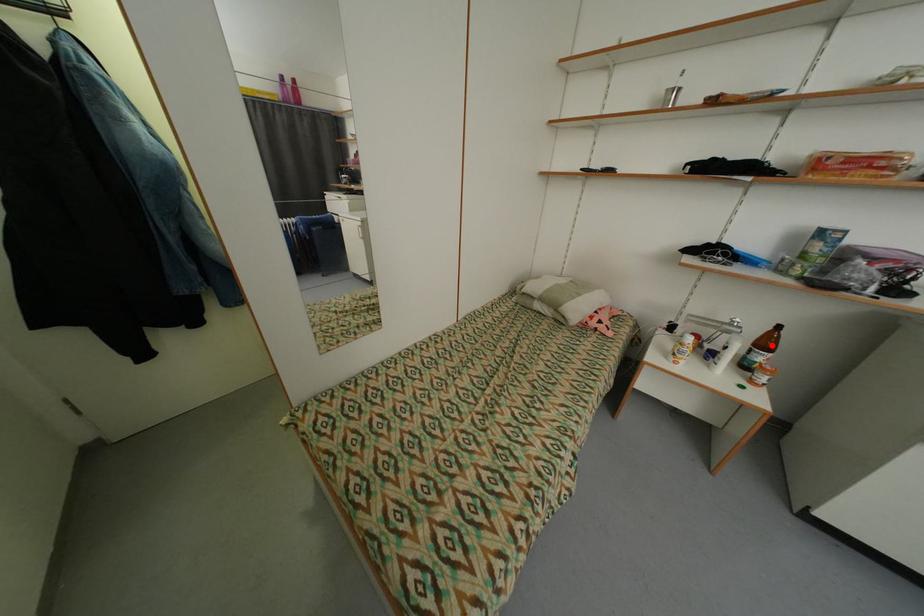
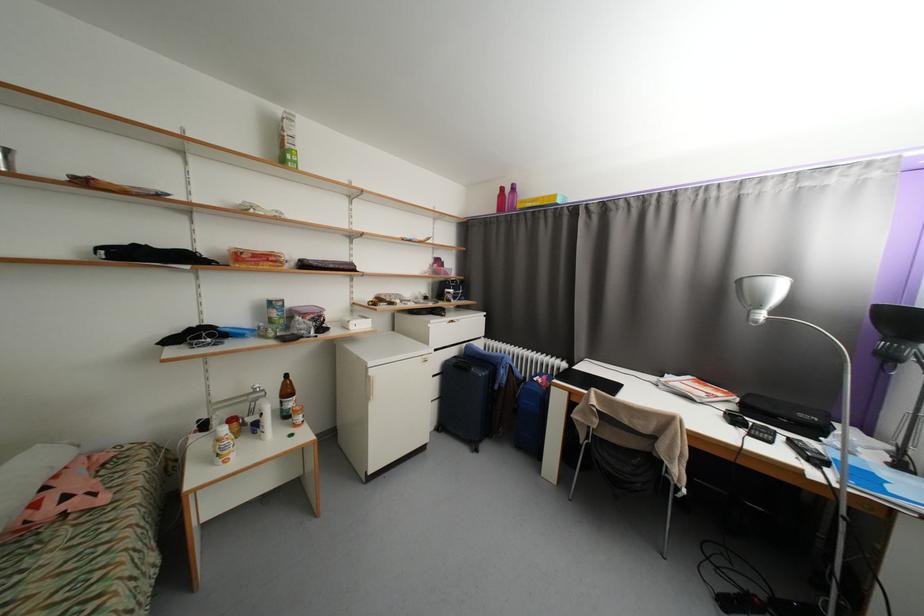
Locate, in the second image, the point that corresponds to the highlighted location in the first image.

(294, 392)